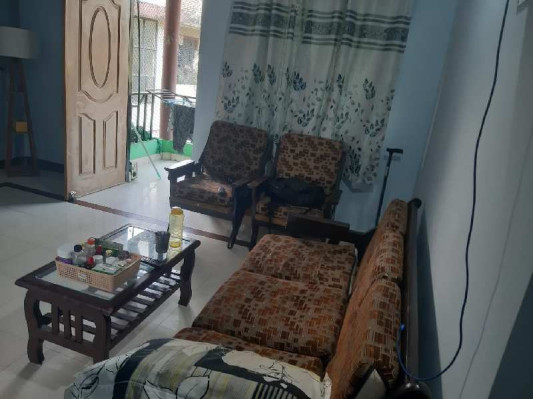
Image resolution: width=533 pixels, height=399 pixels. I want to click on front door, so click(94, 103).